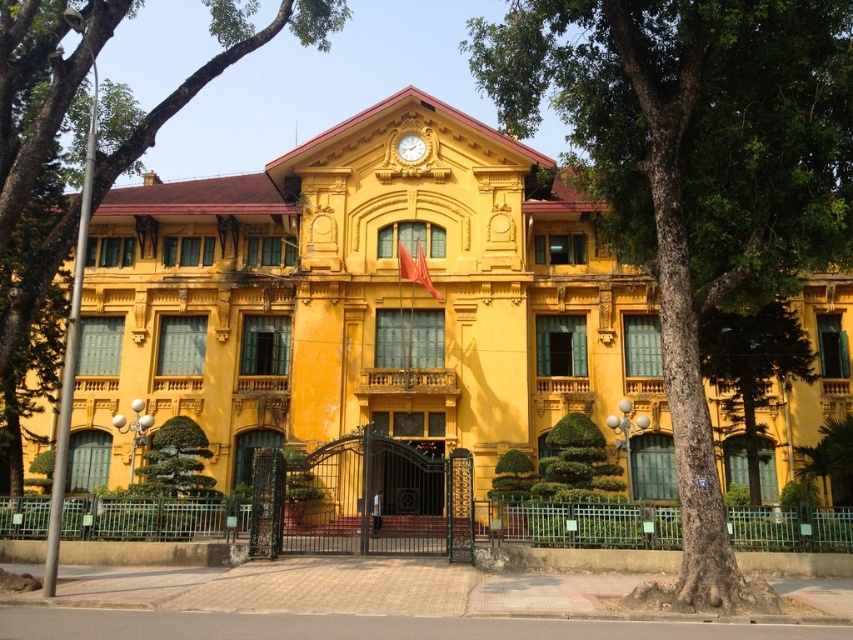
Who is shorter, yellow matte building at center or green textured tree at center?

With less height is yellow matte building at center.

Where is `yellow matte building at center`? The width and height of the screenshot is (853, 640). yellow matte building at center is located at coordinates (364, 304).

This screenshot has width=853, height=640. Find the location of `yellow matte building at center`. yellow matte building at center is located at coordinates (364, 304).

Is green textured tree at lower right below gold textured clock at center?

Correct, green textured tree at lower right is located below gold textured clock at center.

Is green textured tree at lower right wider than gold textured clock at center?

Yes.

Measure the distance between point (776, 337) and camera.

A distance of 48.50 meters exists between point (776, 337) and camera.

In order to click on green textured tree at lower right in this screenshot , I will do `click(752, 371)`.

Is the position of green textured tree at center less distant than that of gold textured clock at center?

Yes.

This screenshot has width=853, height=640. Identify the location of green textured tree at center. (693, 182).